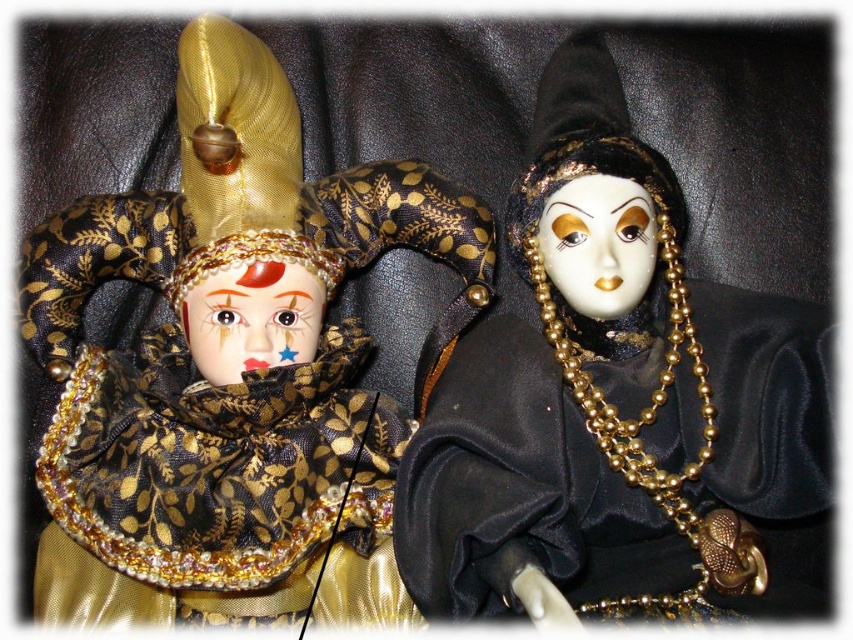
Does point (221, 579) come in front of point (579, 182)?

Yes, it is.

Is gold brocade jester at center below porcelain mask at center?

Yes, gold brocade jester at center is below porcelain mask at center.

What do you see at coordinates (230, 369) in the screenshot? The image size is (853, 640). I see `gold brocade jester at center` at bounding box center [230, 369].

You are a GUI agent. You are given a task and a screenshot of the screen. Output one action in this format:
    pyautogui.click(x=<x>, y=<y>)
    Task: Click on the gold brocade jester at center
    
    Given the screenshot: What is the action you would take?
    pyautogui.click(x=230, y=369)

Does porcelain mask at center have a larger size compared to porcelain face at center?

Actually, porcelain mask at center might be smaller than porcelain face at center.

Between porcelain mask at center and porcelain face at center, which one has more height?

Standing taller between the two is porcelain mask at center.

Find the location of a particular element. The height and width of the screenshot is (640, 853). porcelain mask at center is located at coordinates (598, 243).

Can you confirm if black satin doll at center is positioned to the left of porcelain face at center?

No, black satin doll at center is not to the left of porcelain face at center.

From the picture: Can you confirm if black satin doll at center is shorter than porcelain face at center?

No.

Is point (769, 609) positioned before point (221, 385)?

Yes, it is in front of point (221, 385).

This screenshot has width=853, height=640. I want to click on black satin doll at center, so click(618, 406).